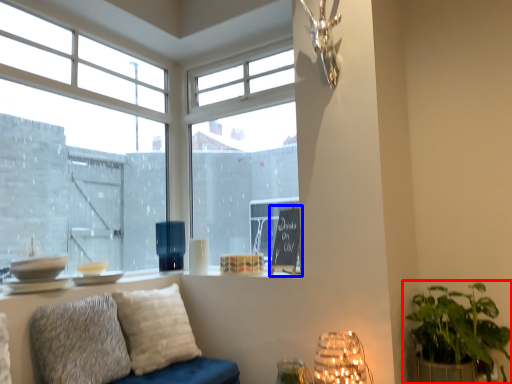
Question: Among these objects, which one is farthest to the camera, houseplant (highlighted by a red box) or bulletin board (highlighted by a blue box)?

Choices:
 (A) houseplant
 (B) bulletin board

Answer: (B)